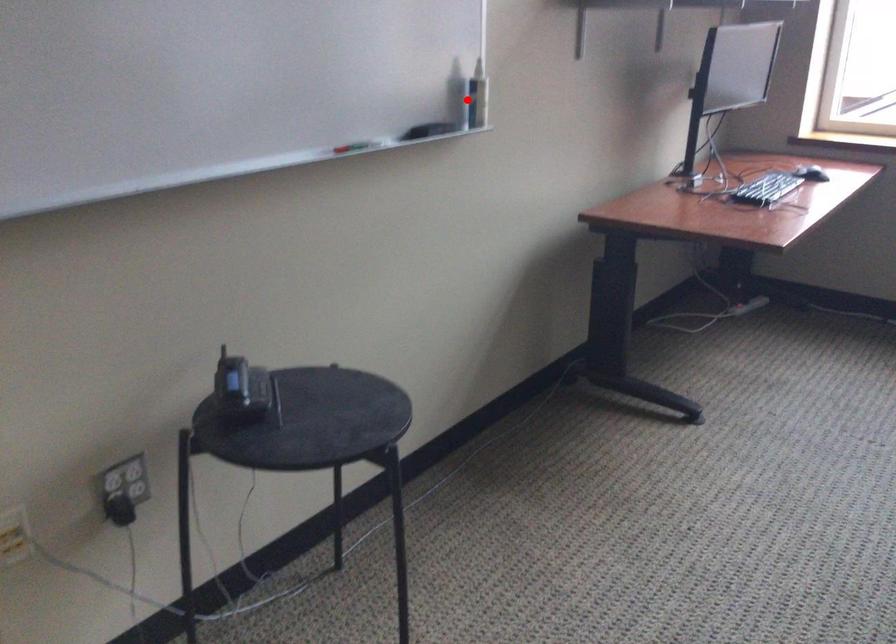
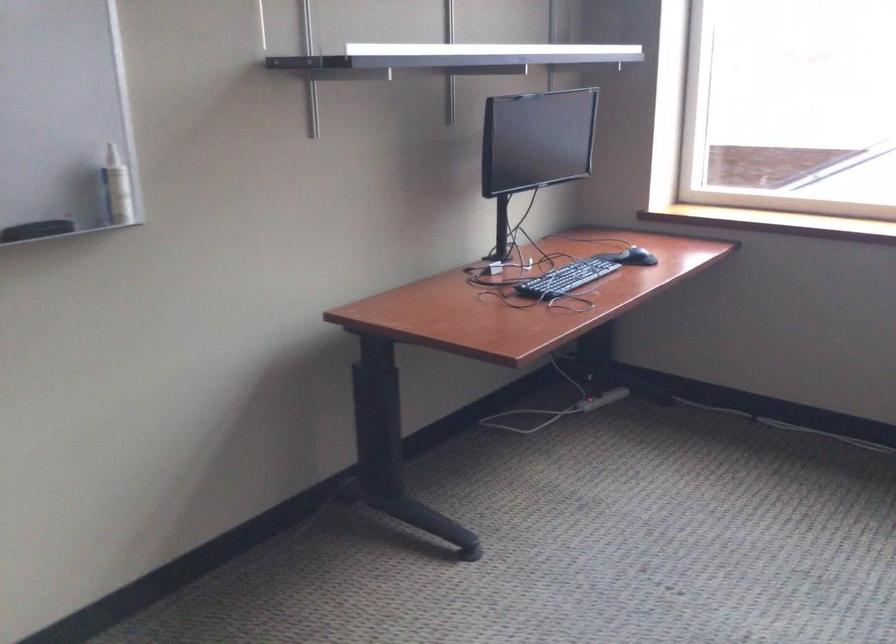
The point at the highlighted location is marked in the first image. Where is the corresponding point in the second image?

(117, 187)